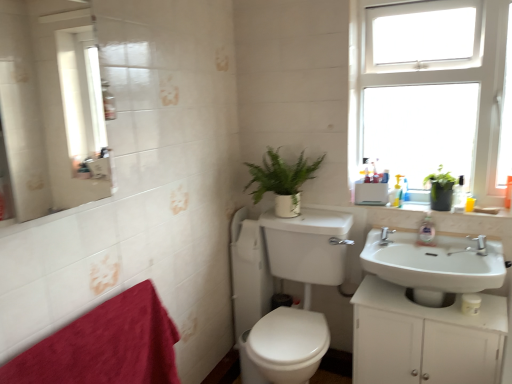
At what (x,y) coordinates should I click in order to perform the action: click on free space that is in between green matte plant at upper right and translucent plastic soap dispenser at upper right, placed as the 1th toiletry when sorted from left to right. Please return your answer as a coordinate pair (x, y). The image size is (512, 384). Looking at the image, I should click on (412, 202).